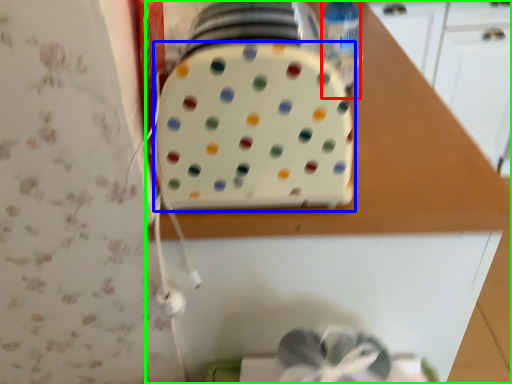
Question: Which object is the closest to the bottle (highlighted by a red box)? Choose among these: toaster (highlighted by a blue box) or countertop (highlighted by a green box).

Choices:
 (A) toaster
 (B) countertop

Answer: (A)